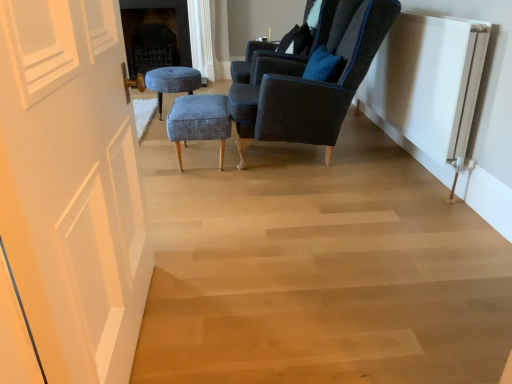
Locate an element on the screen. Image resolution: width=512 pixels, height=384 pixels. free space to the left of white ribbed radiator at right is located at coordinates (310, 186).